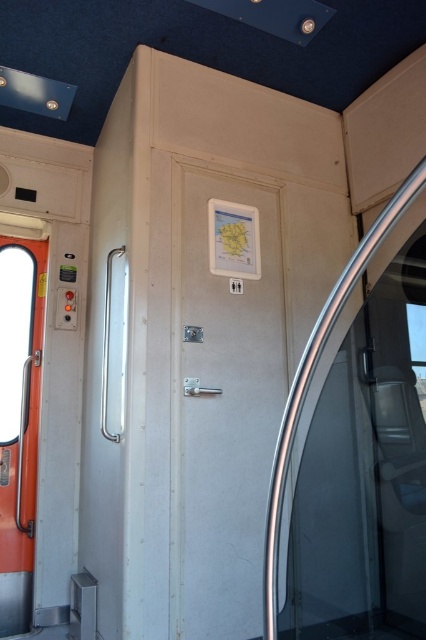
Between orange glossy screen door at left and transparent glass door at right, which one appears on the left side from the viewer's perspective?

orange glossy screen door at left is more to the left.

Is point (14, 502) positioned after point (301, 372)?

Yes, it is.

Where is `orange glossy screen door at left`? orange glossy screen door at left is located at coordinates (19, 420).

Does white matte door at center lie in front of orange glossy screen door at left?

Yes.

Image resolution: width=426 pixels, height=640 pixels. I want to click on white matte door at center, so click(x=222, y=396).

Can you confirm if white matte door at center is wider than transparent glass door at right?

Indeed, white matte door at center has a greater width compared to transparent glass door at right.

Can you confirm if white matte door at center is positioned below transparent glass door at right?

Yes.

What do you see at coordinates (222, 396) in the screenshot?
I see `white matte door at center` at bounding box center [222, 396].

Identify the location of white matte door at center. (222, 396).